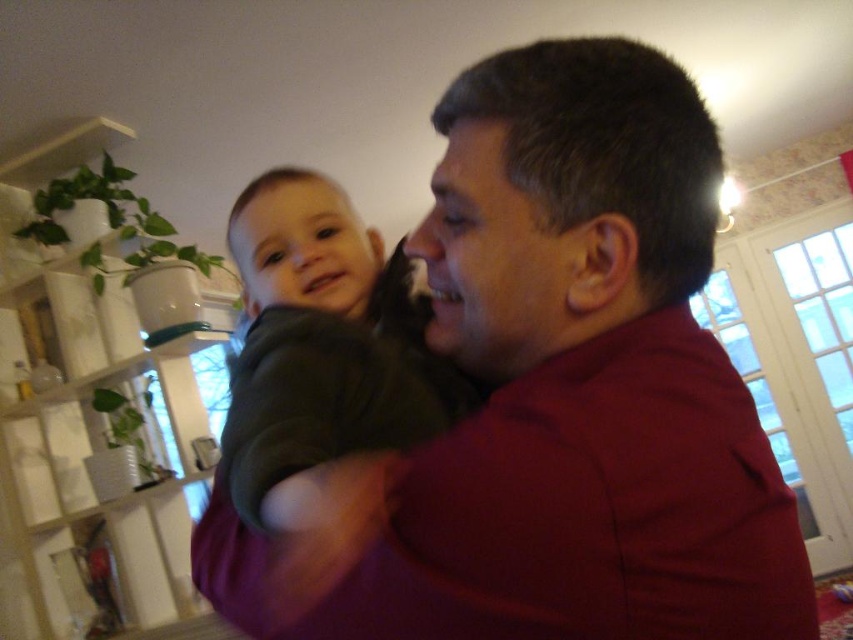
Can you confirm if matte red shirt at center is positioned below dark green sweater at center?

Yes, matte red shirt at center is below dark green sweater at center.

Who is higher up, matte red shirt at center or dark green sweater at center?

dark green sweater at center

Looking at this image, who is more distant from viewer, (689, 547) or (358, 280)?

Point (358, 280)

I want to click on matte red shirt at center, so click(556, 394).